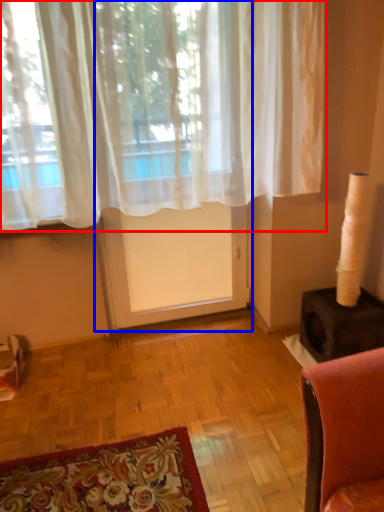
Question: Among these objects, which one is farthest to the camera, curtain (highlighted by a red box) or screen door (highlighted by a blue box)?

Choices:
 (A) curtain
 (B) screen door

Answer: (B)